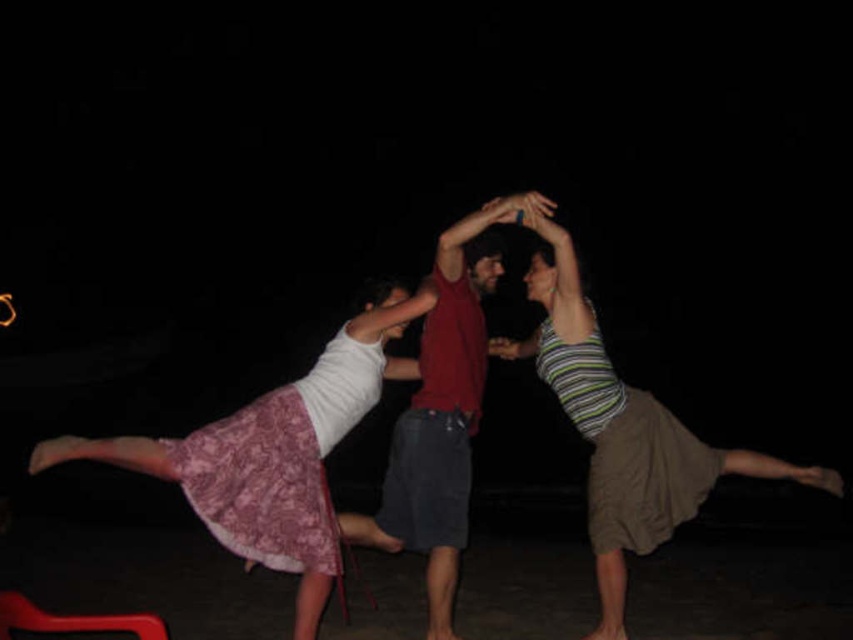
Between point (225, 435) and point (656, 422), which one is positioned behind?

Positioned behind is point (656, 422).

Which is more to the left, matte pink lace skirt at left or striped cotton tank top at center?

matte pink lace skirt at left

Where is `matte pink lace skirt at left`? This screenshot has width=853, height=640. matte pink lace skirt at left is located at coordinates (271, 454).

The image size is (853, 640). Find the location of `matte pink lace skirt at left`. matte pink lace skirt at left is located at coordinates (271, 454).

Can you confirm if matte pink lace skirt at left is wider than rubberized red chair at lower left?

Yes.

Is point (309, 545) more distant than point (143, 625)?

Yes, it is behind point (143, 625).

The image size is (853, 640). Find the location of `matte pink lace skirt at left`. matte pink lace skirt at left is located at coordinates (271, 454).

Is striped cotton tank top at center further to the viewer compared to matte red shirt at center?

That is True.

Between striped cotton tank top at center and matte red shirt at center, which one has more height?

matte red shirt at center

Find the location of a particular element. striped cotton tank top at center is located at coordinates (621, 428).